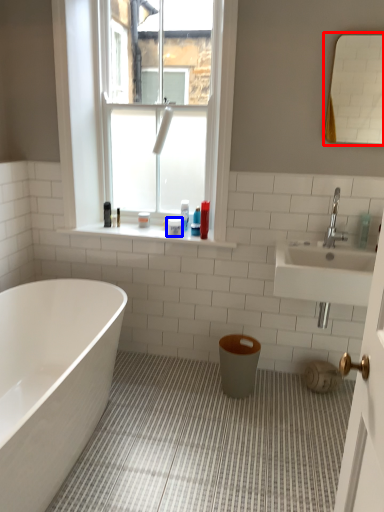
Question: Which object is closer to the camera taking this photo, mirror (highlighted by a red box) or toiletry (highlighted by a blue box)?

Choices:
 (A) mirror
 (B) toiletry

Answer: (A)